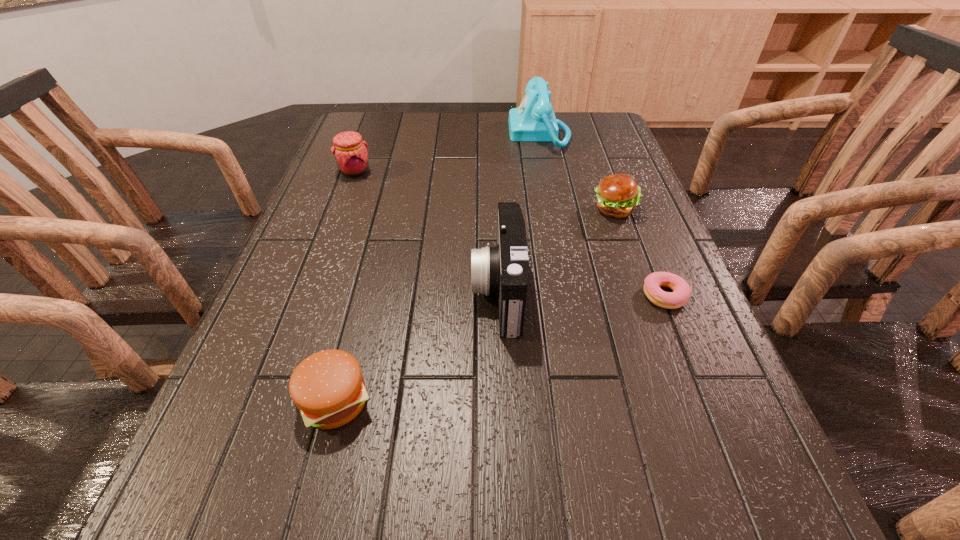
This screenshot has width=960, height=540. In order to click on jam at the left edge in this screenshot , I will do `click(350, 151)`.

Where is `hamburger situated at the left edge`? hamburger situated at the left edge is located at coordinates (328, 388).

This screenshot has height=540, width=960. In order to click on telephone that is at the right edge in this screenshot , I will do `click(534, 120)`.

Identify the location of hamburger present at the right edge. Image resolution: width=960 pixels, height=540 pixels. (617, 195).

Locate an element on the screen. The width and height of the screenshot is (960, 540). doughnut at the right edge is located at coordinates (681, 292).

Locate an element on the screen. Image resolution: width=960 pixels, height=540 pixels. object present at the far right corner is located at coordinates (534, 120).

You are a GUI agent. You are given a task and a screenshot of the screen. Output one action in this format:
    pyautogui.click(x=<x>, y=<y>)
    Task: Click on the free space at the far edge
    
    Given the screenshot: What is the action you would take?
    tap(396, 127)

I want to click on vacant region at the left edge of the desktop, so click(x=235, y=425).

Image resolution: width=960 pixels, height=540 pixels. Find the location of `free spot at the right edge of the desktop`. free spot at the right edge of the desktop is located at coordinates (641, 207).

You are a GUI agent. You are given a task and a screenshot of the screen. Output one action in this format:
    pyautogui.click(x=<x>, y=<y>)
    Task: Click on the vacant region at the far right corner of the desktop
    The height and width of the screenshot is (540, 960).
    Given the screenshot: What is the action you would take?
    pyautogui.click(x=565, y=119)